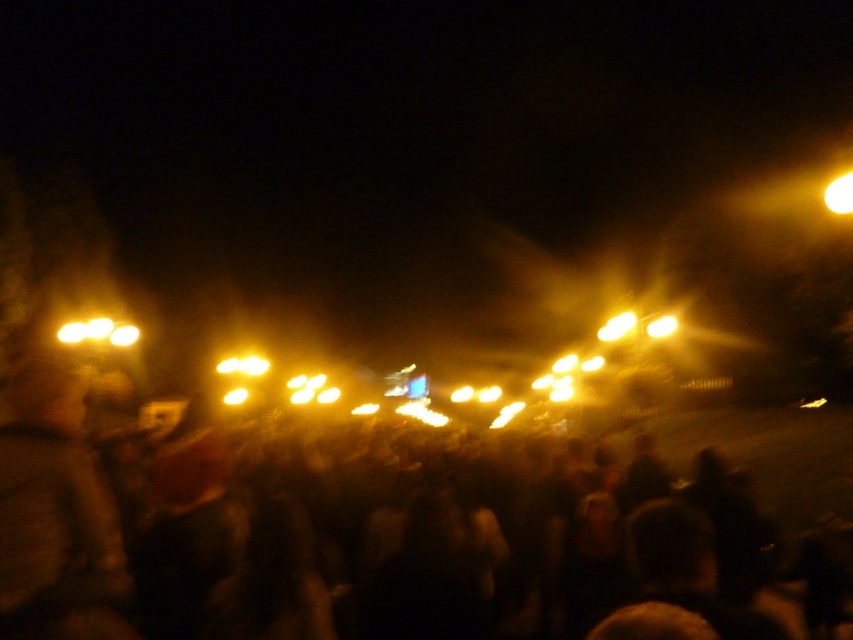
Question: Which point is farther to the camera?

Choices:
 (A) black matte crowd at center
 (B) matte yellow lights at left

Answer: (B)

Question: From the image, what is the correct spatial relationship of matte yellow lights at left in relation to yellow frosted bulb at upper right?

Choices:
 (A) left
 (B) right

Answer: (A)

Question: Does matte yellow lights at left come in front of matte yellow light at upper right?

Choices:
 (A) yes
 (B) no

Answer: (A)

Question: Which point is closer to the camera?

Choices:
 (A) (838, 209)
 (B) (726, 624)

Answer: (B)

Question: Does yellow matte light at upper right appear over matte yellow light at upper right?

Choices:
 (A) yes
 (B) no

Answer: (A)

Question: Which point is closer to the camera?

Choices:
 (A) (608, 337)
 (B) (653, 588)

Answer: (B)